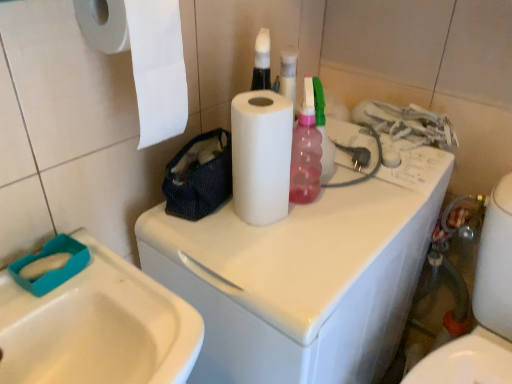
Question: Can we say white glossy sink at lower left lies outside white paper at upper left, marked as the 2th paper towel in a right-to-left arrangement?

Choices:
 (A) yes
 (B) no

Answer: (A)

Question: From the image's perspective, is white glossy sink at lower left on top of white paper at upper left, which is the first paper towel in left-to-right order?

Choices:
 (A) yes
 (B) no

Answer: (B)

Question: Can you confirm if white glossy sink at lower left is positioned to the right of white paper at upper left, marked as the 2th paper towel in a right-to-left arrangement?

Choices:
 (A) yes
 (B) no

Answer: (B)

Question: Does white glossy sink at lower left come behind white paper at upper left, which is the first paper towel in left-to-right order?

Choices:
 (A) yes
 (B) no

Answer: (B)

Question: Can you confirm if white glossy sink at lower left is wider than white paper at upper left, marked as the 2th paper towel in a right-to-left arrangement?

Choices:
 (A) no
 (B) yes

Answer: (B)

Question: Is white glossy toilet at lower right inside the boundaries of white paper at upper left, which is the first paper towel in left-to-right order, or outside?

Choices:
 (A) outside
 (B) inside

Answer: (A)

Question: Is point (476, 327) closer or farther from the camera than point (103, 14)?

Choices:
 (A) farther
 (B) closer

Answer: (A)

Question: Is white glossy toilet at lower right wider or thinner than white paper at upper left, which is the first paper towel in left-to-right order?

Choices:
 (A) wide
 (B) thin

Answer: (B)

Question: Is white glossy toilet at lower right taller or shorter than white paper at upper left, which is the first paper towel in left-to-right order?

Choices:
 (A) short
 (B) tall

Answer: (B)

Question: Looking at the image, does white matte paper towel at center, the 2th paper towel viewed from the left, seem bigger or smaller compared to white paper at upper left, marked as the 2th paper towel in a right-to-left arrangement?

Choices:
 (A) small
 (B) big

Answer: (A)

Question: Is white matte paper towel at center, which is the first paper towel from right to left, spatially inside white paper at upper left, which is the first paper towel in left-to-right order, or outside of it?

Choices:
 (A) outside
 (B) inside

Answer: (A)

Question: Is white matte paper towel at center, which is the first paper towel from right to left, taller or shorter than white paper at upper left, marked as the 2th paper towel in a right-to-left arrangement?

Choices:
 (A) short
 (B) tall

Answer: (A)

Question: Would you say white matte paper towel at center, the 2th paper towel viewed from the left, is to the left or to the right of white paper at upper left, which is the first paper towel in left-to-right order, in the picture?

Choices:
 (A) left
 (B) right

Answer: (B)

Question: In the image, is white paper at upper left, which is the first paper towel in left-to-right order, on the left side or the right side of white matte paper towel at center, the 2th paper towel viewed from the left?

Choices:
 (A) left
 (B) right

Answer: (A)

Question: Is point (156, 82) positioned closer to the camera than point (249, 114)?

Choices:
 (A) closer
 (B) farther

Answer: (A)